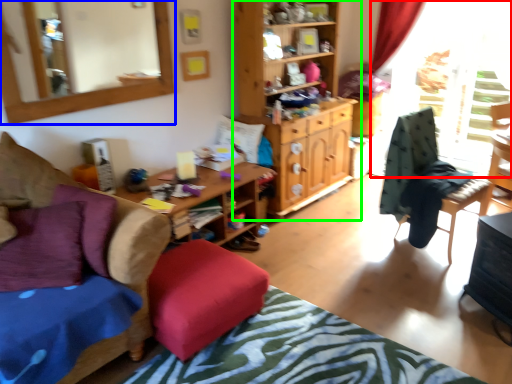
Question: Estimate the real-world distances between objects in this image. Which object is farther from window screen (highlighted by a red box), mirror (highlighted by a blue box) or cabinetry (highlighted by a green box)?

Choices:
 (A) mirror
 (B) cabinetry

Answer: (A)